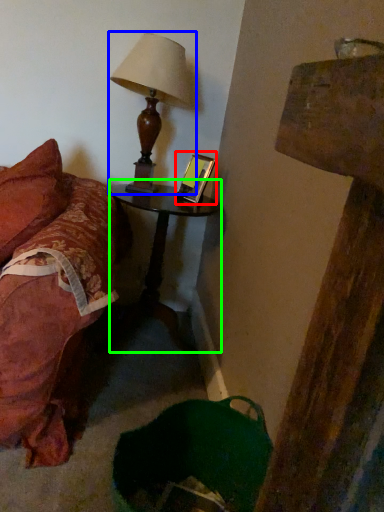
Question: Which object is positioned closest to picture frame (highlighted by a red box)? Select from lamp (highlighted by a blue box) and nightstand (highlighted by a green box).

Choices:
 (A) lamp
 (B) nightstand

Answer: (A)